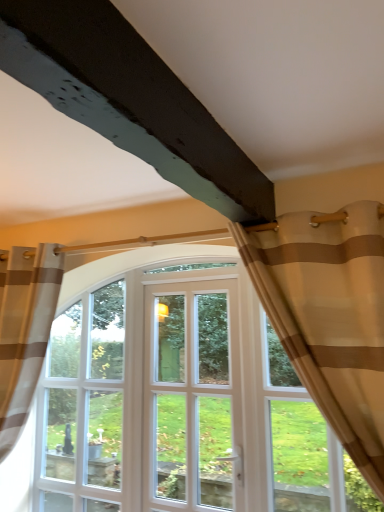
Question: Does beige striped curtain at upper right, the second curtain viewed from the left, have a larger size compared to brown striped curtain at left, positioned as the 2th curtain in right-to-left order?

Choices:
 (A) yes
 (B) no

Answer: (B)

Question: Can you confirm if beige striped curtain at upper right, which is the first curtain from front to back, is wider than brown striped curtain at left, positioned as the 2th curtain in right-to-left order?

Choices:
 (A) no
 (B) yes

Answer: (A)

Question: Considering the relative sizes of beige striped curtain at upper right, which is the second curtain in back-to-front order, and brown striped curtain at left, positioned as the 2th curtain in right-to-left order, in the image provided, is beige striped curtain at upper right, which is the second curtain in back-to-front order, shorter than brown striped curtain at left, positioned as the 2th curtain in right-to-left order,?

Choices:
 (A) no
 (B) yes

Answer: (B)

Question: From the image's perspective, is beige striped curtain at upper right, the second curtain viewed from the left, located above brown striped curtain at left, positioned as the 2th curtain in front-to-back order?

Choices:
 (A) no
 (B) yes

Answer: (B)

Question: Can we say beige striped curtain at upper right, which is the first curtain from right to left, lies outside brown striped curtain at left, positioned as the 2th curtain in right-to-left order?

Choices:
 (A) no
 (B) yes

Answer: (B)

Question: From a real-world perspective, is beige striped curtain at upper right, which is the first curtain from right to left, over brown striped curtain at left, marked as the 1th curtain in a back-to-front arrangement?

Choices:
 (A) no
 (B) yes

Answer: (B)

Question: Is beige striped curtain at upper right, the second curtain viewed from the left, further to the viewer compared to white glass door at center?

Choices:
 (A) yes
 (B) no

Answer: (B)

Question: From the image's perspective, is beige striped curtain at upper right, the second curtain viewed from the left, located above white glass door at center?

Choices:
 (A) no
 (B) yes

Answer: (B)

Question: Can you confirm if beige striped curtain at upper right, which is the first curtain from right to left, is shorter than white glass door at center?

Choices:
 (A) yes
 (B) no

Answer: (A)

Question: Does beige striped curtain at upper right, which is the second curtain in back-to-front order, have a greater height compared to white glass door at center?

Choices:
 (A) no
 (B) yes

Answer: (A)

Question: Is beige striped curtain at upper right, which is the second curtain in back-to-front order, oriented towards white glass door at center?

Choices:
 (A) no
 (B) yes

Answer: (A)

Question: From the image's perspective, is beige striped curtain at upper right, which is the first curtain from front to back, located beneath white glass door at center?

Choices:
 (A) no
 (B) yes

Answer: (A)

Question: Does brown striped curtain at left, positioned as the 2th curtain in front-to-back order, appear on the right side of beige striped curtain at upper right, which is the first curtain from right to left?

Choices:
 (A) yes
 (B) no

Answer: (B)